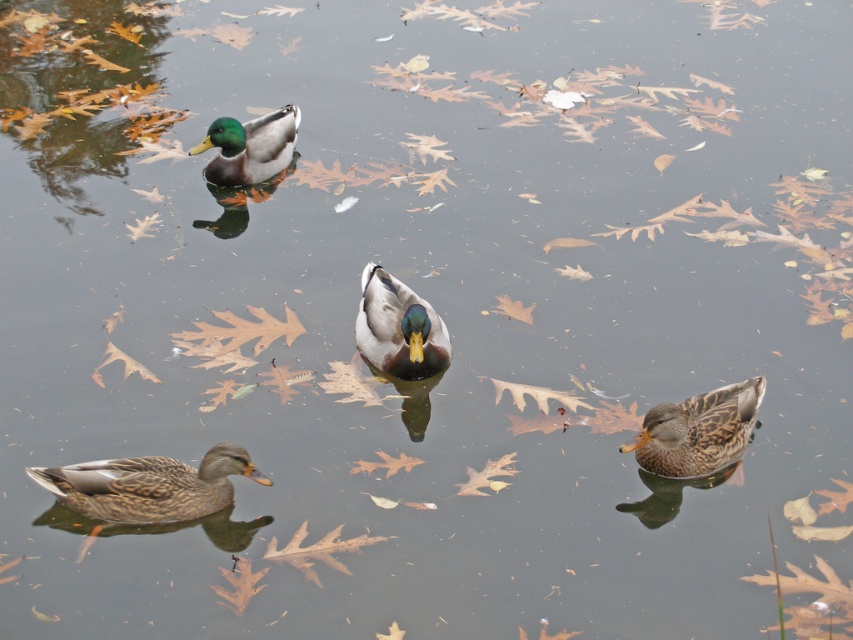
Question: Is the position of brown speckled duck at lower right less distant than that of shiny green duck at center?

Choices:
 (A) no
 (B) yes

Answer: (B)

Question: Does brown speckled duck at lower right have a smaller size compared to green glossy duck at upper center?

Choices:
 (A) yes
 (B) no

Answer: (A)

Question: Does brown matte duck at lower left appear over shiny green duck at center?

Choices:
 (A) no
 (B) yes

Answer: (A)

Question: Which point appears closest to the camera in this image?

Choices:
 (A) (57, 474)
 (B) (396, 284)
 (C) (252, 132)
 (D) (724, 417)

Answer: (A)

Question: Estimate the real-world distances between objects in this image. Which object is farther from the brown speckled duck at lower right?

Choices:
 (A) shiny green duck at center
 (B) green glossy duck at upper center

Answer: (B)

Question: Which point is farther to the camera?

Choices:
 (A) coord(254,141)
 (B) coord(409,292)
 (C) coord(181,464)

Answer: (A)